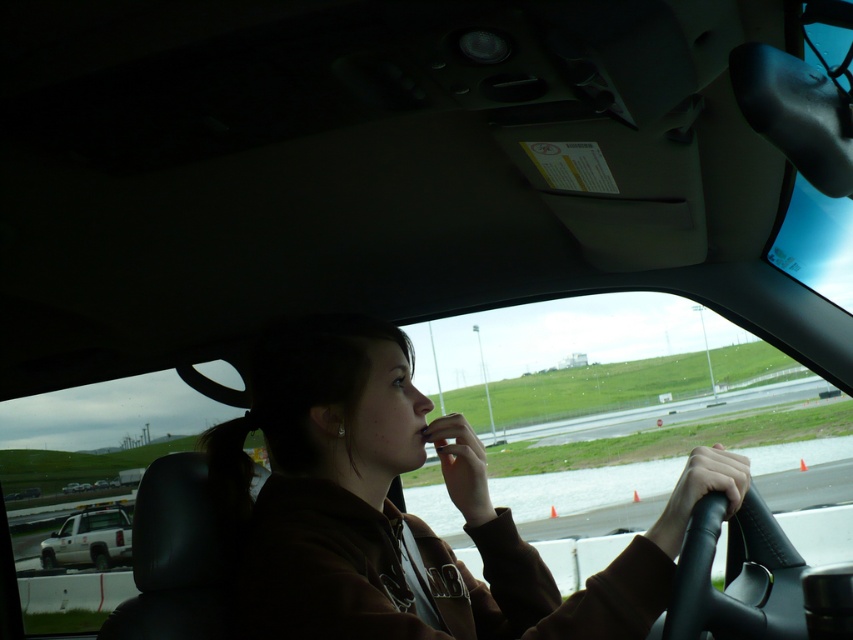
Can you confirm if brown cotton jacket at center is positioned above white matte truck at lower left?

Indeed, brown cotton jacket at center is positioned over white matte truck at lower left.

Is point (451, 476) closer to camera compared to point (102, 531)?

Yes.

Does point (279, 456) come farther from viewer compared to point (71, 522)?

No, it is not.

This screenshot has height=640, width=853. I want to click on brown cotton jacket at center, so click(x=404, y=513).